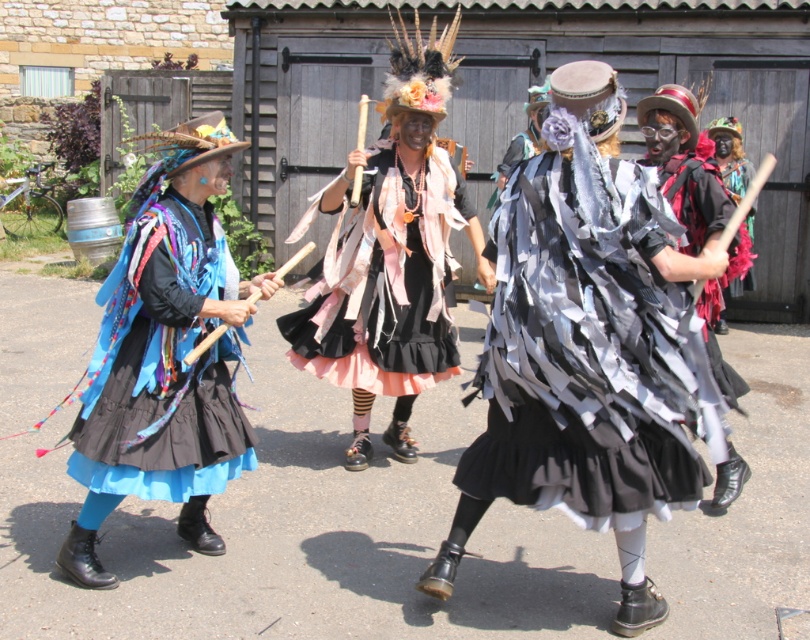
You are a photographer at the event and need to frame a shot that includes both the matte blue fabric skirt at left and the black feathered headdress at center. Which object should you adjust your focus on to ensure both are in the frame without cropping?

Since the matte blue fabric skirt at left occupies less space than the black feathered headdress at center, you should focus on the larger object, the black feathered headdress at center, to ensure both fit in the frame.

You are a photographer trying to capture the central figure in the scene. The ruffled pink fabric skirt at center and the matte blue fabric skirt at left are both in your view. Which skirt is closer to the camera?

The ruffled pink fabric skirt at center is positioned over the matte blue fabric skirt at left, meaning it is closer to the camera.

You are a photographer planning to take a group photo of the ruffled pink fabric skirt at center and the matte blue fabric skirt at left. Which skirt should you focus on first to ensure it appears taller in the photo?

The ruffled pink fabric skirt at center is taller than the matte blue fabric skirt at left, so focusing on it first will ensure it appears taller in the photo.